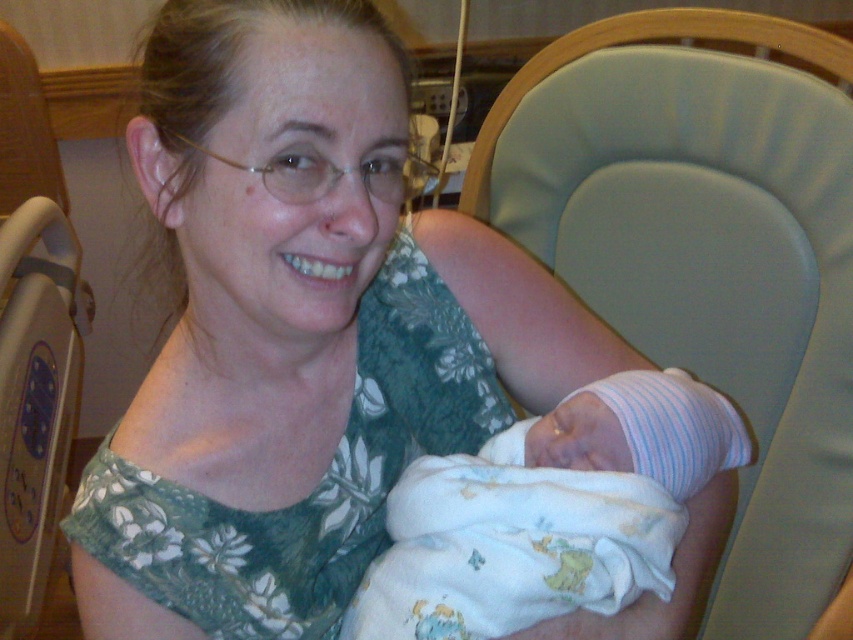
Question: Which point is closer to the camera taking this photo?

Choices:
 (A) (712, 438)
 (B) (619, 209)

Answer: (A)

Question: Among these objects, which one is nearest to the camera?

Choices:
 (A) light green fabric chair at center
 (B) white soft swaddled newborn at center

Answer: (B)

Question: Can you confirm if light green fabric chair at center is bigger than white soft swaddled newborn at center?

Choices:
 (A) no
 (B) yes

Answer: (B)

Question: Does light green fabric chair at center appear on the left side of white soft swaddled newborn at center?

Choices:
 (A) yes
 (B) no

Answer: (B)

Question: Does light green fabric chair at center have a smaller size compared to white soft swaddled newborn at center?

Choices:
 (A) no
 (B) yes

Answer: (A)